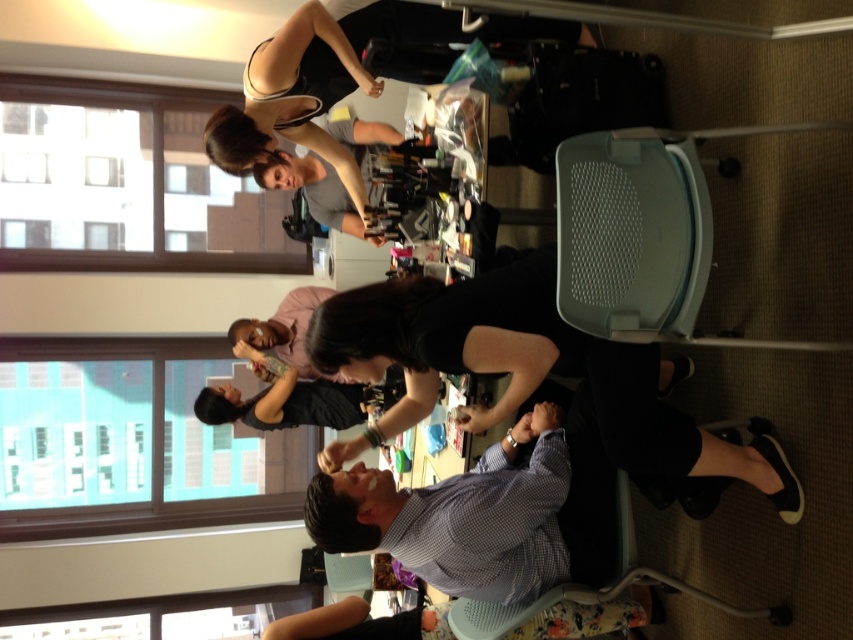
Can you confirm if black matte shirt at center is positioned above black matte tank top at upper center?

Incorrect, black matte shirt at center is not positioned above black matte tank top at upper center.

Who is higher up, black matte shirt at center or black matte tank top at upper center?

Positioned higher is black matte tank top at upper center.

Does point (370, 304) come closer to viewer compared to point (345, 92)?

Yes, point (370, 304) is closer to viewer.

I want to click on black matte shirt at center, so click(527, 372).

Between black matte shirt at center and checkered fabric shirt at center, which one appears on the right side from the viewer's perspective?

Positioned to the right is black matte shirt at center.

In order to click on black matte shirt at center in this screenshot , I will do coord(527,372).

At what (x,y) coordinates should I click in order to perform the action: click on black matte shirt at center. Please return your answer as a coordinate pair (x, y). Looking at the image, I should click on (527, 372).

Find the location of a particular element. The width and height of the screenshot is (853, 640). checkered fabric shirt at center is located at coordinates (460, 516).

Does checkered fabric shirt at center appear on the left side of black matte tank top at upper center?

Incorrect, checkered fabric shirt at center is not on the left side of black matte tank top at upper center.

In the scene shown: Measure the distance between checkered fabric shirt at center and camera.

The distance of checkered fabric shirt at center from camera is 1.93 meters.

Where is `checkered fabric shirt at center`? The height and width of the screenshot is (640, 853). checkered fabric shirt at center is located at coordinates (460, 516).